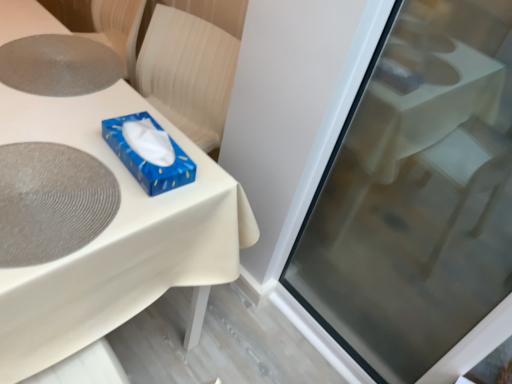
You are a GUI agent. You are given a task and a screenshot of the screen. Output one action in this format:
    pyautogui.click(x=<x>, y=<y>)
    Task: Click on the vacant region above gray textured placemat at upper left, which is the first oval from back to front (from a real-world perspective)
    This screenshot has width=512, height=384.
    Given the screenshot: What is the action you would take?
    pyautogui.click(x=53, y=58)